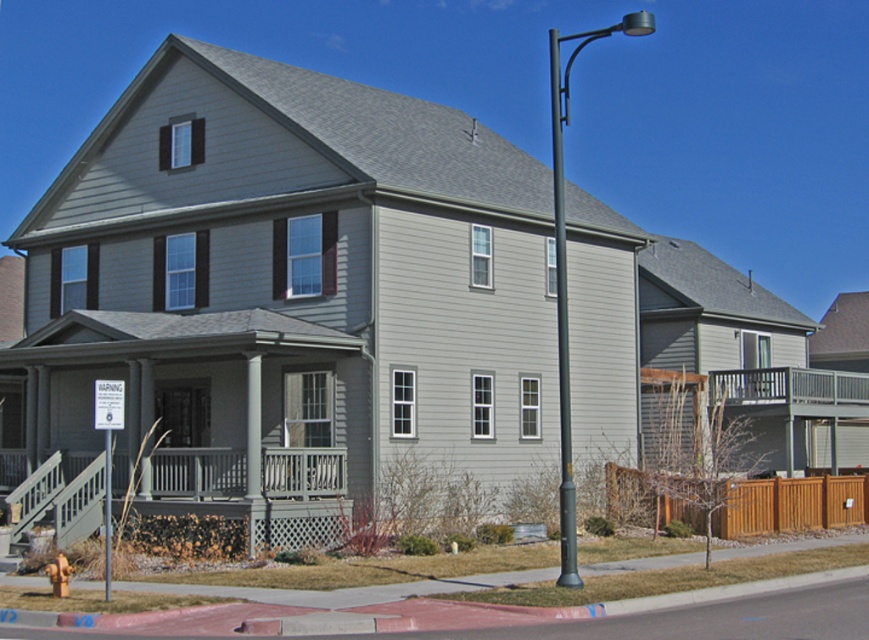
Question: Is metallic gray pole at right positioned behind black metal pole at right?

Choices:
 (A) no
 (B) yes

Answer: (A)

Question: Among these points, which one is farthest from the camera?

Choices:
 (A) (314, 541)
 (B) (554, 172)

Answer: (B)

Question: In this image, where is matte gray porch at lower left located relative to black metal pole at right?

Choices:
 (A) left
 (B) right

Answer: (A)

Question: Which point is farther to the camera?

Choices:
 (A) matte gray porch at lower left
 (B) metallic gray pole at right

Answer: (A)

Question: Which point appears closest to the camera in this image?

Choices:
 (A) (568, 364)
 (B) (555, 65)

Answer: (A)

Question: Is matte gray porch at lower left smaller than metallic gray pole at right?

Choices:
 (A) no
 (B) yes

Answer: (B)